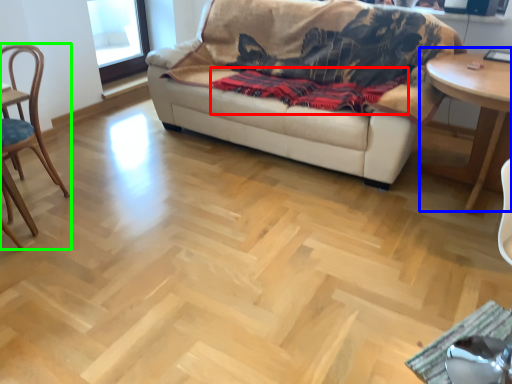
Question: Estimate the real-world distances between objects in this image. Which object is closer to blanket (highlighted by a red box), table (highlighted by a blue box) or chair (highlighted by a green box)?

Choices:
 (A) table
 (B) chair

Answer: (A)